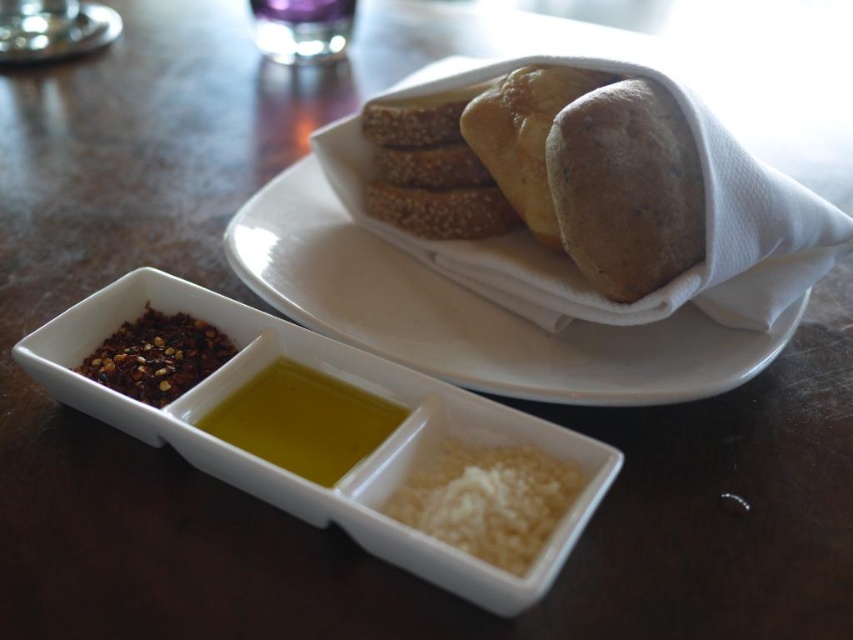
In the scene shown: You are a guest at a dinner table and want to reach both the sesame seed bread at upper center and the golden brown crusty bread at upper right. Which bread should you grab first to avoid knocking over the condiment tray?

You should grab the sesame seed bread at upper center first because it is closer to you than the golden brown crusty bread at upper right, so it is easier to reach without disturbing the condiment tray.

You are a guest at a dinner table and want to reach both the bread and the condiment tray. The bread is located at point [344,305] and the condiment tray is at point [669,221]. Which item will you need to reach further back to grab?

You will need to reach further back to grab the condiment tray at point [669,221] because point [344,305] is closer to you than point [669,221].

You are a chef standing at the table and need to place a new spice jar on the table. The spice jar must be placed exactly 10 cm to the right of the sesame seed bread at upper center. Where should you place the spice jar?

The sesame seed bread at upper center is located at point (469, 314). To place the spice jar 10 cm to the right, you should position it at point (469, 378).